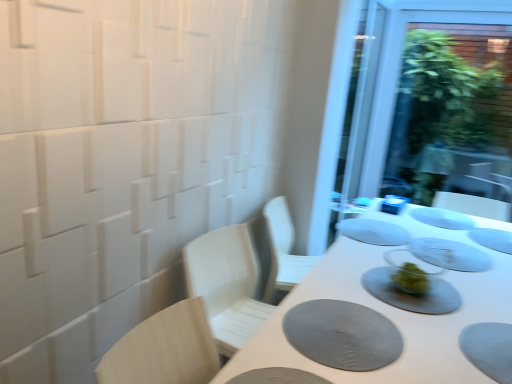
Where is `vacant space situated above white matte plate at center, the 5th tableware viewed from the front (from a real-world perspective)`? This screenshot has height=384, width=512. vacant space situated above white matte plate at center, the 5th tableware viewed from the front (from a real-world perspective) is located at coordinates (445, 217).